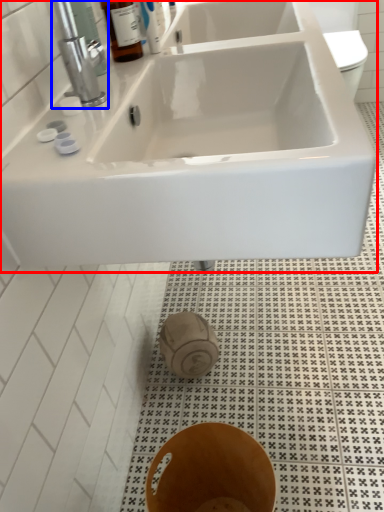
Question: Which point is further to the camera, sink (highlighted by a red box) or tap (highlighted by a blue box)?

Choices:
 (A) sink
 (B) tap

Answer: (B)